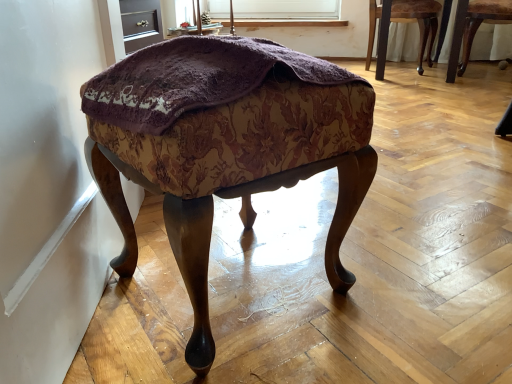
At what (x,y) coordinates should I click in order to perform the action: click on free area below velvet-like fabric stool at center (from a real-world perspective). Please return your answer as a coordinate pair (x, y). The width and height of the screenshot is (512, 384). Looking at the image, I should click on (229, 282).